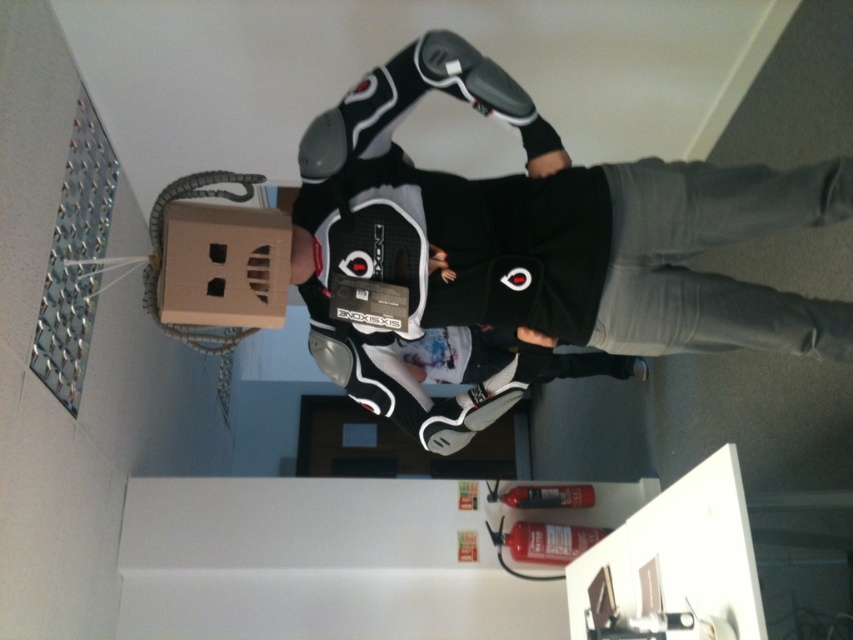
Question: Is black matte jacket at center positioned in front of cardboard box at upper left?

Choices:
 (A) yes
 (B) no

Answer: (B)

Question: Is black matte jacket at center further to camera compared to cardboard box at upper left?

Choices:
 (A) no
 (B) yes

Answer: (B)

Question: Among these points, which one is farthest from the camera?

Choices:
 (A) pyautogui.click(x=283, y=317)
 (B) pyautogui.click(x=793, y=189)

Answer: (A)

Question: Is black matte jacket at center to the right of cardboard box at upper left from the viewer's perspective?

Choices:
 (A) yes
 (B) no

Answer: (A)